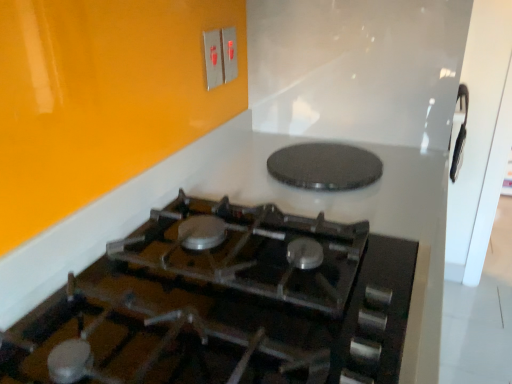
The image size is (512, 384). What do you see at coordinates (229, 54) in the screenshot? I see `metallic silver switch at upper center, marked as the 2th electric outlet in a left-to-right arrangement` at bounding box center [229, 54].

Describe the element at coordinates (213, 58) in the screenshot. The height and width of the screenshot is (384, 512). I see `metallic switch at upper center, which is the 2th electric outlet from right to left` at that location.

What do you see at coordinates (325, 166) in the screenshot? The height and width of the screenshot is (384, 512). I see `black textured pizza pan at upper center` at bounding box center [325, 166].

Where is `metallic silver switch at upper center, placed as the 1th electric outlet when sorted from right to left`? The height and width of the screenshot is (384, 512). metallic silver switch at upper center, placed as the 1th electric outlet when sorted from right to left is located at coordinates (229, 54).

Measure the distance from black glass gas stove at center to metallic switch at upper center, which is the 2th electric outlet from right to left.

They are 29.40 inches apart.

From the image's perspective, between black glass gas stove at center and metallic switch at upper center, which is counted as the first electric outlet, starting from the left, which one is located above?

From the image's view, metallic switch at upper center, which is counted as the first electric outlet, starting from the left, is above.

Can you tell me how much black glass gas stove at center and metallic switch at upper center, which is the 2th electric outlet from right to left, differ in facing direction?

The angular difference between black glass gas stove at center and metallic switch at upper center, which is the 2th electric outlet from right to left, is 0.406 degrees.

From their relative heights in the image, would you say black glass gas stove at center is taller or shorter than metallic switch at upper center, which is the 2th electric outlet from right to left?

Clearly, black glass gas stove at center is shorter compared to metallic switch at upper center, which is the 2th electric outlet from right to left.

Between point (206, 69) and point (352, 153), which one is positioned in front?

The point (352, 153) is closer to the camera.

From the picture: Is metallic switch at upper center, which is counted as the first electric outlet, starting from the left, facing away from black textured pizza pan at upper center?

No, metallic switch at upper center, which is counted as the first electric outlet, starting from the left, is not facing the opposite direction of black textured pizza pan at upper center.

Is metallic switch at upper center, which is the 2th electric outlet from right to left, shorter than black textured pizza pan at upper center?

Incorrect, the height of metallic switch at upper center, which is the 2th electric outlet from right to left, does not fall short of that of black textured pizza pan at upper center.

From a real-world perspective, which is physically above, metallic switch at upper center, which is the 2th electric outlet from right to left, or black textured pizza pan at upper center?

metallic switch at upper center, which is the 2th electric outlet from right to left, from a real-world perspective.

From a real-world perspective, is metallic switch at upper center, which is counted as the first electric outlet, starting from the left, below black glass gas stove at center?

No, from a real-world perspective, metallic switch at upper center, which is counted as the first electric outlet, starting from the left, is not below black glass gas stove at center.

Is metallic switch at upper center, which is the 2th electric outlet from right to left, not near black glass gas stove at center?

No.

From the picture: Can you confirm if metallic switch at upper center, which is the 2th electric outlet from right to left, is shorter than black glass gas stove at center?

No, metallic switch at upper center, which is the 2th electric outlet from right to left, is not shorter than black glass gas stove at center.

From a real-world perspective, is metallic switch at upper center, which is counted as the first electric outlet, starting from the left, on metallic silver switch at upper center, marked as the 2th electric outlet in a left-to-right arrangement?

Yes, from a real-world perspective, metallic switch at upper center, which is counted as the first electric outlet, starting from the left, is above metallic silver switch at upper center, marked as the 2th electric outlet in a left-to-right arrangement.

Does metallic switch at upper center, which is the 2th electric outlet from right to left, come behind metallic silver switch at upper center, marked as the 2th electric outlet in a left-to-right arrangement?

No, metallic switch at upper center, which is the 2th electric outlet from right to left, is closer to the camera.

Which is more to the right, metallic switch at upper center, which is counted as the first electric outlet, starting from the left, or metallic silver switch at upper center, marked as the 2th electric outlet in a left-to-right arrangement?

Positioned to the right is metallic silver switch at upper center, marked as the 2th electric outlet in a left-to-right arrangement.

Considering the sizes of metallic switch at upper center, which is the 2th electric outlet from right to left, and metallic silver switch at upper center, marked as the 2th electric outlet in a left-to-right arrangement, in the image, is metallic switch at upper center, which is the 2th electric outlet from right to left, wider or thinner than metallic silver switch at upper center, marked as the 2th electric outlet in a left-to-right arrangement,?

Clearly, metallic switch at upper center, which is the 2th electric outlet from right to left, has more width compared to metallic silver switch at upper center, marked as the 2th electric outlet in a left-to-right arrangement.

Could you measure the distance between black textured pizza pan at upper center and metallic silver switch at upper center, placed as the 1th electric outlet when sorted from right to left?

A distance of 17.79 inches exists between black textured pizza pan at upper center and metallic silver switch at upper center, placed as the 1th electric outlet when sorted from right to left.

Does black textured pizza pan at upper center have a lesser height compared to metallic silver switch at upper center, placed as the 1th electric outlet when sorted from right to left?

Yes.

Would you consider black textured pizza pan at upper center to be distant from metallic silver switch at upper center, placed as the 1th electric outlet when sorted from right to left?

That's not correct — black textured pizza pan at upper center is a little close to metallic silver switch at upper center, placed as the 1th electric outlet when sorted from right to left.

Measure the distance between black glass gas stove at center and metallic silver switch at upper center, marked as the 2th electric outlet in a left-to-right arrangement.

A distance of 32.07 inches exists between black glass gas stove at center and metallic silver switch at upper center, marked as the 2th electric outlet in a left-to-right arrangement.

Is black glass gas stove at center bigger than metallic silver switch at upper center, marked as the 2th electric outlet in a left-to-right arrangement?

Yes.

From the image's perspective, is black glass gas stove at center above or below metallic silver switch at upper center, placed as the 1th electric outlet when sorted from right to left?

black glass gas stove at center is situated lower than metallic silver switch at upper center, placed as the 1th electric outlet when sorted from right to left, in the image.

Consider the image. From a real-world perspective, is black glass gas stove at center under metallic silver switch at upper center, marked as the 2th electric outlet in a left-to-right arrangement?

Indeed, from a real-world perspective, black glass gas stove at center is positioned beneath metallic silver switch at upper center, marked as the 2th electric outlet in a left-to-right arrangement.

From their relative heights in the image, would you say black textured pizza pan at upper center is taller or shorter than black glass gas stove at center?

Considering their sizes, black textured pizza pan at upper center has less height than black glass gas stove at center.

Can you tell me how much black textured pizza pan at upper center and black glass gas stove at center differ in facing direction?

The facing directions of black textured pizza pan at upper center and black glass gas stove at center are 0.000481 degrees apart.

From the picture: Can black glass gas stove at center be found inside black textured pizza pan at upper center?

Definitely not — black glass gas stove at center is not inside black textured pizza pan at upper center.

Would you say black textured pizza pan at upper center is a long distance from black glass gas stove at center?

black textured pizza pan at upper center is near black glass gas stove at center, not far away.

This screenshot has height=384, width=512. In the image, there is a metallic switch at upper center, which is the 2th electric outlet from right to left. Find the location of `gas stove below it (from a real-world perspective)`. gas stove below it (from a real-world perspective) is located at coordinates (225, 304).

This screenshot has height=384, width=512. Identify the location of pizza pan on the right of metallic switch at upper center, which is the 2th electric outlet from right to left. (325, 166).

Looking at the image, which one is located further to metallic silver switch at upper center, marked as the 2th electric outlet in a left-to-right arrangement, black textured pizza pan at upper center or black glass gas stove at center?

black glass gas stove at center.

Looking at the image, which one is located closer to metallic silver switch at upper center, marked as the 2th electric outlet in a left-to-right arrangement, black glass gas stove at center or metallic switch at upper center, which is counted as the first electric outlet, starting from the left?

Among the two, metallic switch at upper center, which is counted as the first electric outlet, starting from the left, is located nearer to metallic silver switch at upper center, marked as the 2th electric outlet in a left-to-right arrangement.

Considering their positions, is black glass gas stove at center positioned further to metallic switch at upper center, which is the 2th electric outlet from right to left, than black textured pizza pan at upper center?

black glass gas stove at center lies further to metallic switch at upper center, which is the 2th electric outlet from right to left, than the other object.

In the scene shown: Considering their positions, is metallic switch at upper center, which is the 2th electric outlet from right to left, positioned closer to black textured pizza pan at upper center than black glass gas stove at center?

black glass gas stove at center is closer to black textured pizza pan at upper center.

Which object lies further to the anchor point metallic switch at upper center, which is counted as the first electric outlet, starting from the left, black glass gas stove at center or metallic silver switch at upper center, marked as the 2th electric outlet in a left-to-right arrangement?

black glass gas stove at center.

From the image, which object appears to be nearer to metallic switch at upper center, which is the 2th electric outlet from right to left, black textured pizza pan at upper center or black glass gas stove at center?

black textured pizza pan at upper center lies closer to metallic switch at upper center, which is the 2th electric outlet from right to left, than the other object.

Looking at this image, which object lies further to the anchor point metallic switch at upper center, which is counted as the first electric outlet, starting from the left, metallic silver switch at upper center, placed as the 1th electric outlet when sorted from right to left, or black textured pizza pan at upper center?

black textured pizza pan at upper center lies further to metallic switch at upper center, which is counted as the first electric outlet, starting from the left, than the other object.

Based on their spatial positions, is metallic switch at upper center, which is counted as the first electric outlet, starting from the left, or metallic silver switch at upper center, marked as the 2th electric outlet in a left-to-right arrangement, closer to black glass gas stove at center?

metallic switch at upper center, which is counted as the first electric outlet, starting from the left, is closer to black glass gas stove at center.

Locate an element on the screen. This screenshot has width=512, height=384. electric outlet between black glass gas stove at center and metallic silver switch at upper center, marked as the 2th electric outlet in a left-to-right arrangement, from front to back is located at coordinates (213, 58).

Image resolution: width=512 pixels, height=384 pixels. Find the location of `electric outlet between metallic silver switch at upper center, marked as the 2th electric outlet in a left-to-right arrangement, and black textured pizza pan at upper center, in the vertical direction`. electric outlet between metallic silver switch at upper center, marked as the 2th electric outlet in a left-to-right arrangement, and black textured pizza pan at upper center, in the vertical direction is located at coordinates (213, 58).

This screenshot has width=512, height=384. What are the coordinates of `pizza pan between black glass gas stove at center and metallic switch at upper center, which is the 2th electric outlet from right to left, in the front-back direction` in the screenshot? It's located at (325, 166).

The height and width of the screenshot is (384, 512). Identify the location of pizza pan between black glass gas stove at center and metallic silver switch at upper center, marked as the 2th electric outlet in a left-to-right arrangement, along the z-axis. tap(325, 166).